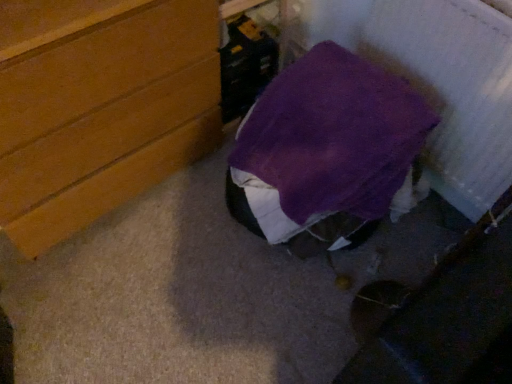
Question: From the image's perspective, is purple fabric bag at center located above or below wooden chest of drawers at left?

Choices:
 (A) above
 (B) below

Answer: (B)

Question: Considering the positions of purple fabric bag at center and wooden chest of drawers at left in the image, is purple fabric bag at center wider or thinner than wooden chest of drawers at left?

Choices:
 (A) wide
 (B) thin

Answer: (A)

Question: Considering the positions of purple fabric bag at center and wooden chest of drawers at left in the image, is purple fabric bag at center taller or shorter than wooden chest of drawers at left?

Choices:
 (A) tall
 (B) short

Answer: (B)

Question: Is wooden chest of drawers at left to the left or to the right of purple fabric bag at center in the image?

Choices:
 (A) left
 (B) right

Answer: (A)

Question: Considering the positions of wooden chest of drawers at left and purple fabric bag at center in the image, is wooden chest of drawers at left taller or shorter than purple fabric bag at center?

Choices:
 (A) short
 (B) tall

Answer: (B)

Question: From the image's perspective, is wooden chest of drawers at left positioned above or below purple fabric bag at center?

Choices:
 (A) below
 (B) above

Answer: (B)

Question: Looking at their shapes, would you say wooden chest of drawers at left is wider or thinner than purple fabric bag at center?

Choices:
 (A) thin
 (B) wide

Answer: (A)